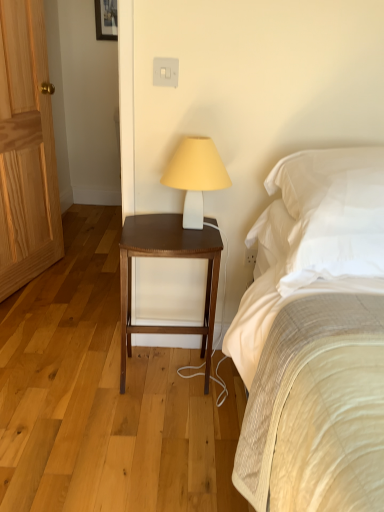
Question: Is white matte table lamp at upper center bigger than natural wood door at left?

Choices:
 (A) no
 (B) yes

Answer: (A)

Question: Is white matte table lamp at upper center not near natural wood door at left?

Choices:
 (A) no
 (B) yes

Answer: (B)

Question: Is white matte table lamp at upper center outside natural wood door at left?

Choices:
 (A) no
 (B) yes

Answer: (B)

Question: Can you confirm if white matte table lamp at upper center is positioned to the right of natural wood door at left?

Choices:
 (A) yes
 (B) no

Answer: (A)

Question: Is white matte table lamp at upper center further to the viewer compared to natural wood door at left?

Choices:
 (A) yes
 (B) no

Answer: (B)

Question: Is white matte table lamp at upper center thinner than natural wood door at left?

Choices:
 (A) yes
 (B) no

Answer: (B)

Question: Is natural wood door at left a part of white soft pillow at upper right?

Choices:
 (A) no
 (B) yes

Answer: (A)

Question: Considering the relative sizes of white soft pillow at upper right and natural wood door at left in the image provided, is white soft pillow at upper right thinner than natural wood door at left?

Choices:
 (A) yes
 (B) no

Answer: (B)

Question: Is white soft pillow at upper right shorter than natural wood door at left?

Choices:
 (A) no
 (B) yes

Answer: (B)

Question: Can you see white soft pillow at upper right touching natural wood door at left?

Choices:
 (A) yes
 (B) no

Answer: (B)

Question: Is white soft pillow at upper right aimed at natural wood door at left?

Choices:
 (A) no
 (B) yes

Answer: (A)

Question: Considering the relative positions of white soft pillow at upper right and natural wood door at left in the image provided, is white soft pillow at upper right in front of natural wood door at left?

Choices:
 (A) no
 (B) yes

Answer: (B)

Question: From a real-world perspective, is dark wood nightstand at center beneath white matte table lamp at upper center?

Choices:
 (A) no
 (B) yes

Answer: (B)